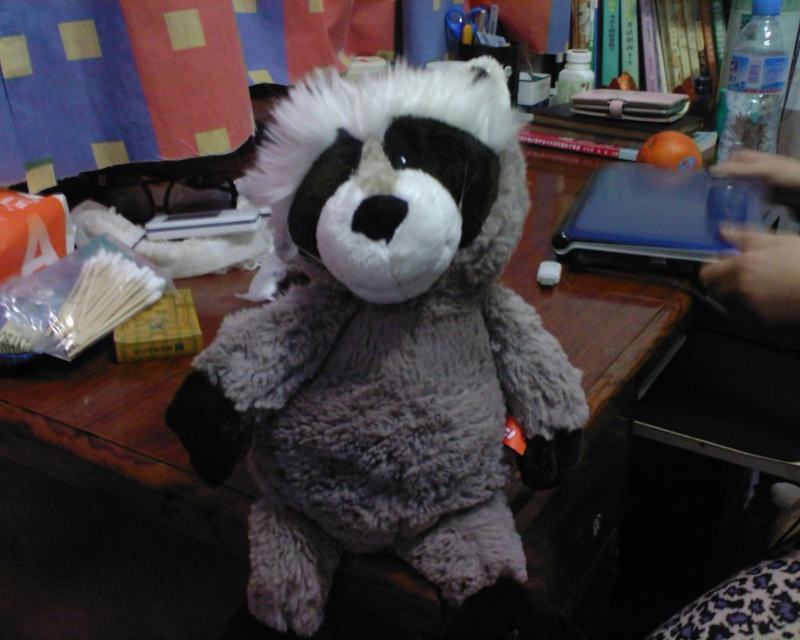
Question: Is fluffy gray teddy bear at center to the left of slate gray plastic laptop at upper right from the viewer's perspective?

Choices:
 (A) yes
 (B) no

Answer: (A)

Question: Does fluffy gray teddy bear at center appear under slate gray plastic laptop at upper right?

Choices:
 (A) no
 (B) yes

Answer: (B)

Question: Does fluffy gray teddy bear at center lie behind slate gray plastic laptop at upper right?

Choices:
 (A) yes
 (B) no

Answer: (B)

Question: Which point appears farthest from the camera in this image?

Choices:
 (A) (389, 216)
 (B) (624, 248)

Answer: (B)